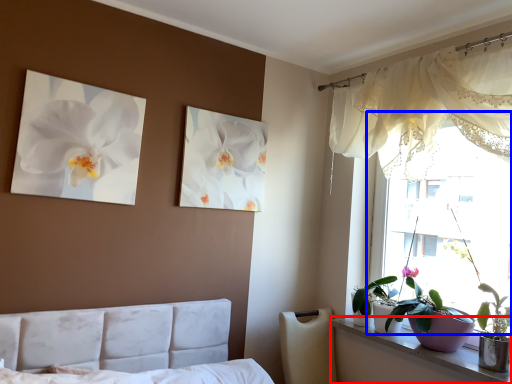
Question: Which object appears farthest to the camera in this image, window sill (highlighted by a red box) or window (highlighted by a blue box)?

Choices:
 (A) window sill
 (B) window

Answer: (B)